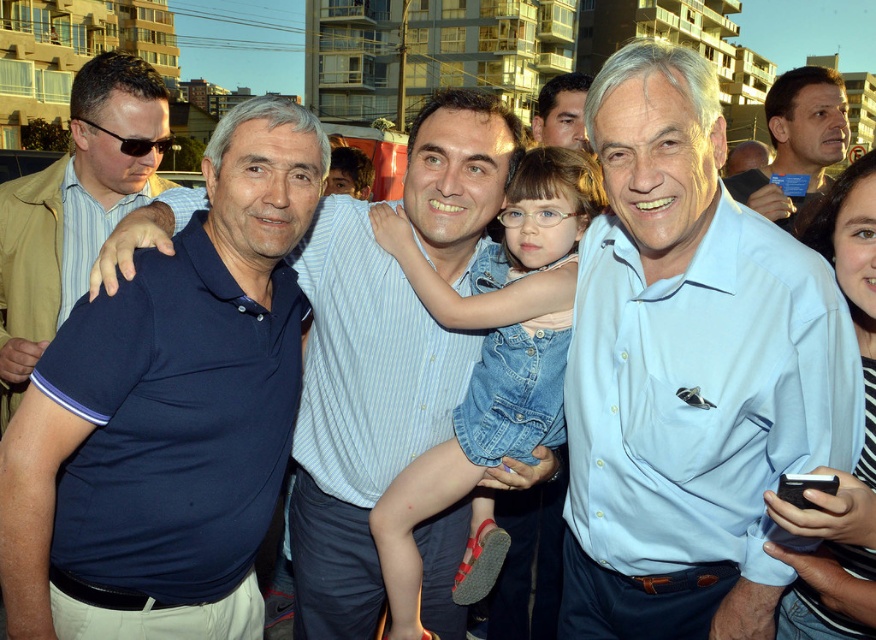
Question: Does matte blue shirt at center have a smaller size compared to smooth skin face at upper center?

Choices:
 (A) no
 (B) yes

Answer: (B)

Question: Which is nearer to the dark blue polo shirt at left?

Choices:
 (A) denim dress at center
 (B) smooth skin face at upper center
 (C) dark blue polo shirt at center

Answer: (A)

Question: Which of the following is the farthest from the observer?

Choices:
 (A) matte blue shirt at center
 (B) smooth skin face at upper center
 (C) dark blue polo shirt at center

Answer: (B)

Question: Can you confirm if matte blue shirt at center is thinner than smooth skin face at upper center?

Choices:
 (A) no
 (B) yes

Answer: (A)

Question: Observing the image, what is the correct spatial positioning of light blue shirt at center in reference to matte blue shirt at center?

Choices:
 (A) below
 (B) above

Answer: (A)

Question: Which point is closer to the camera?

Choices:
 (A) (306, 452)
 (B) (458, 412)
 (C) (539, 108)

Answer: (A)